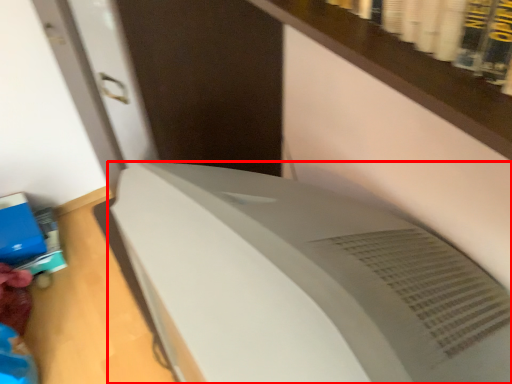
Question: From the image's perspective, what is the correct spatial positioning of home appliance (annotated by the red box) in reference to paperback book?

Choices:
 (A) above
 (B) below

Answer: (B)